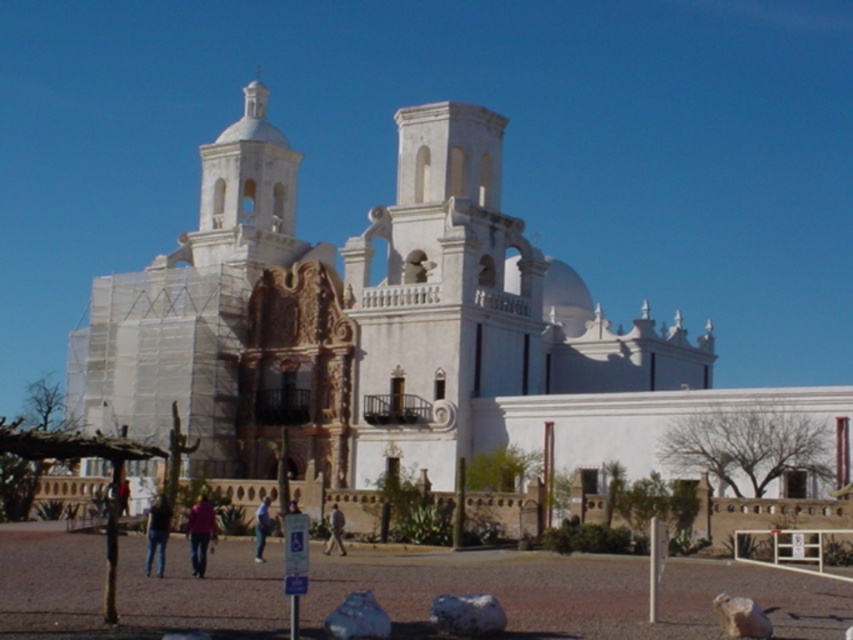
Question: Is white matte stone at lower center smaller than pink fabric at center?

Choices:
 (A) no
 (B) yes

Answer: (B)

Question: Which point is closer to the camera taking this photo?

Choices:
 (A) (157, 525)
 (B) (338, 512)
 (C) (206, 540)
 (D) (442, 611)

Answer: (D)

Question: Where is white stucco church at center located in relation to pink fabric at center in the image?

Choices:
 (A) left
 (B) right

Answer: (B)

Question: Is the position of blue jeans at lower center more distant than that of light brown leather jacket at center?

Choices:
 (A) no
 (B) yes

Answer: (A)

Question: Which of these objects is positioned farthest from the smooth beige rock at lower right?

Choices:
 (A) white matte stone at lower center
 (B) blue jeans at lower center
 (C) white smooth rock at lower center
 (D) white stucco church at center

Answer: (D)

Question: Which object is the closest to the white smooth rock at lower center?

Choices:
 (A) jeans at lower center
 (B) smooth beige rock at lower right

Answer: (B)